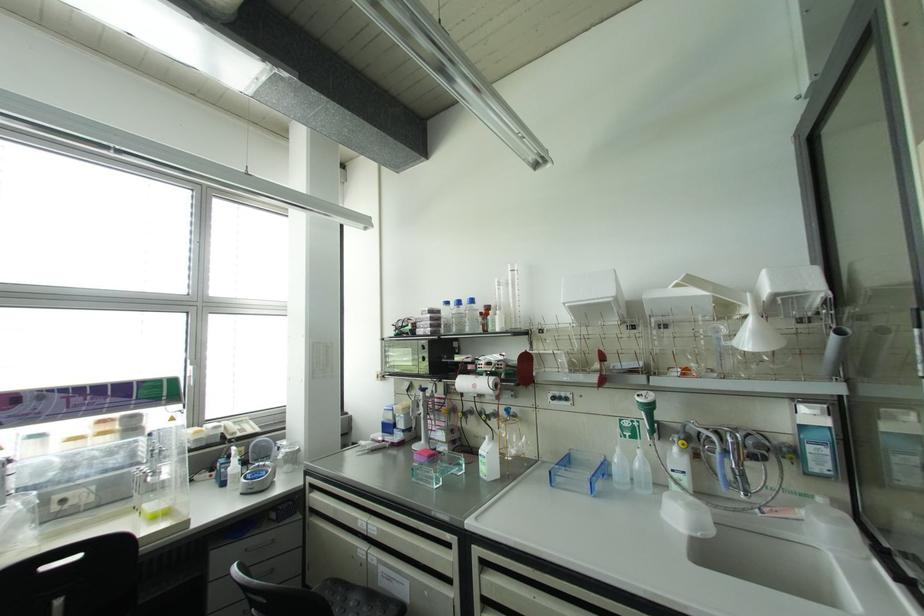
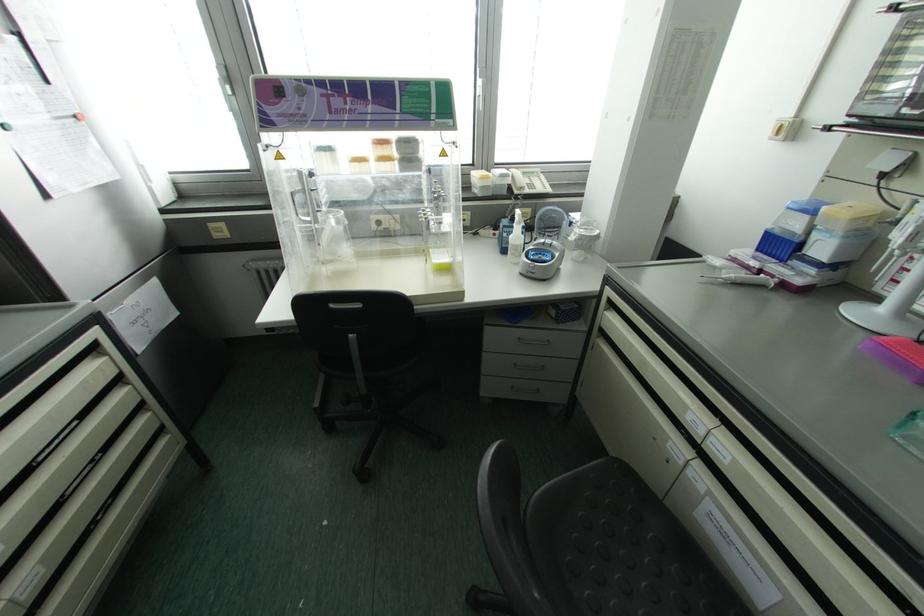
Find the pixel in the second image that matches point (334, 581) in the first image.

(626, 474)